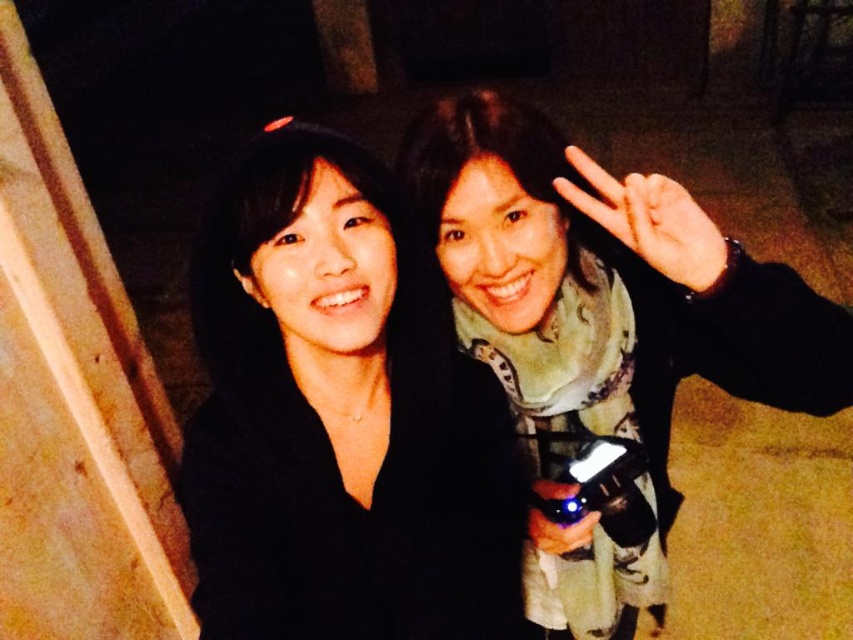
You are a photographer trying to adjust the focus on your camera. The subject is the black matte jacket at center. Based on the scene description, is the jacket within the typical focus range of a standard camera lens set to 50mm focal length with an aperture of f2.8?

The black matte jacket at center is 34.80 inches from the camera. A standard camera lens at 50mm and f2.8 has a depth of field that typically allows sharp focus starting around 30 inches and beyond. Since 34.80 inches falls within this range, the jacket should be in focus.

Looking at this image, you are a photographer trying to decide whether to use the matte black camera at right to take a photo of the matte black hand at upper right. Considering their sizes, will the camera be able to fully capture the hand in the frame without cropping?

The matte black camera at right has a larger size compared to the matte black hand at upper right, so the camera should be able to fully capture the hand in the frame without cropping.

What is the object located at the coordinates point (339,417) in the image?

The object located at point (339,417) is the black matte jacket at center.